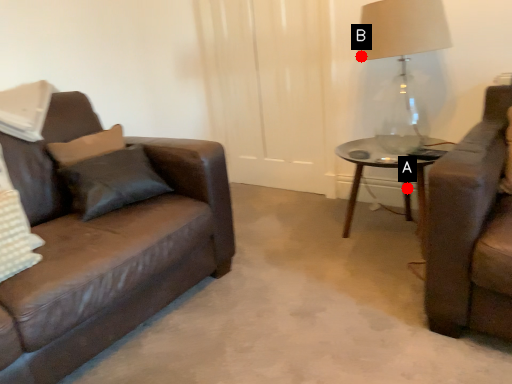
Question: Two points are circled on the image, labeled by A and B beside each circle. Which of the following is the farthest from the observer?

Choices:
 (A) A is further
 (B) B is further

Answer: (A)